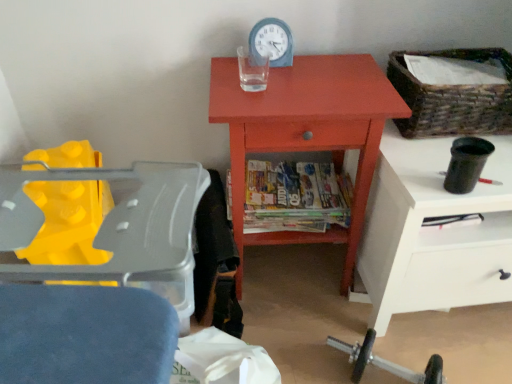
I want to click on empty space that is ontop of matte orange cabinet at center (from a real-world perspective), so tap(301, 78).